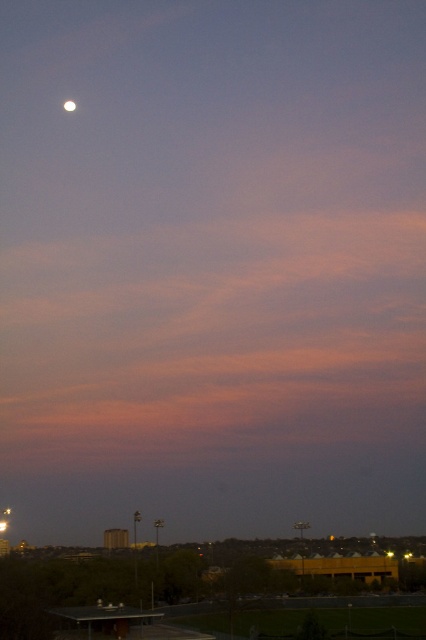
You are standing at the point with coordinates point [71,104] and want to walk towards the point with coordinates point [282,582]. From your current position, which direction should you move to reach the other point?

You should move towards the upper right direction to reach point [282,582] from point [71,104].

You are an astronomer observing the twilight scene. You notice the metallic gray stadium lights at lower center and the silvery reflective moon at upper left. Which object appears closer to you in the image?

The metallic gray stadium lights at lower center appear closer to you because they are positioned nearer in the scene compared to the silvery reflective moon at upper left.

You are an astronomer observing the night sky and notice the metallic gray stadium lights at lower center and the silvery reflective moon at upper left. Which object appears wider in the image?

The metallic gray stadium lights at lower center appear wider than the silvery reflective moon at upper left according to the description.